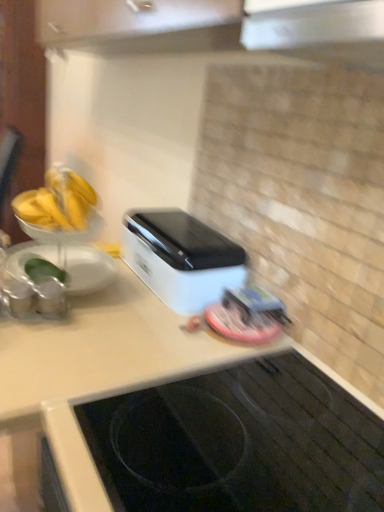
In order to face white glossy countertop at lower center, should I rotate leftwards or rightwards?

It's best to rotate right around 4.122 degrees.

The height and width of the screenshot is (512, 384). I want to click on white glossy countertop at lower center, so click(x=183, y=416).

This screenshot has height=512, width=384. What do you see at coordinates (183, 416) in the screenshot? I see `white glossy countertop at lower center` at bounding box center [183, 416].

In order to face white plastic toaster at center, should I rotate leftwards or rightwards?

Rotate your view left by about 1.999°.

Identify the location of white plastic toaster at center. The height and width of the screenshot is (512, 384). (181, 258).

The height and width of the screenshot is (512, 384). What do you see at coordinates (181, 258) in the screenshot?
I see `white plastic toaster at center` at bounding box center [181, 258].

This screenshot has height=512, width=384. I want to click on white glossy countertop at lower center, so click(183, 416).

Based on the photo, which object is positioned more to the right, white plastic toaster at center or white glossy countertop at lower center?

Positioned to the right is white glossy countertop at lower center.

In the scene shown: Which object is further away from the camera taking this photo, white plastic toaster at center or white glossy countertop at lower center?

white plastic toaster at center is further away from the camera.

Is point (221, 243) behind point (380, 505)?

That is True.

From the image's perspective, which one is positioned higher, white plastic toaster at center or white glossy countertop at lower center?

white plastic toaster at center appears higher in the image.

From a real-world perspective, which is physically below, white plastic toaster at center or white glossy countertop at lower center?

white glossy countertop at lower center, from a real-world perspective.

Does white plastic toaster at center have a lesser width compared to white glossy countertop at lower center?

Yes.

Considering the sizes of objects white plastic toaster at center and white glossy countertop at lower center in the image provided, who is taller, white plastic toaster at center or white glossy countertop at lower center?

white glossy countertop at lower center.

Is white plastic toaster at center smaller than white glossy countertop at lower center?

Indeed, white plastic toaster at center has a smaller size compared to white glossy countertop at lower center.

Is white plastic toaster at center not within white glossy countertop at lower center?

Yes.

Does white plastic toaster at center touch white glossy countertop at lower center?

No, white plastic toaster at center is not next to white glossy countertop at lower center.

Could you tell me if white plastic toaster at center is turned towards white glossy countertop at lower center?

No, white plastic toaster at center does not turn towards white glossy countertop at lower center.

How many degrees apart are the facing directions of white plastic toaster at center and white glossy countertop at lower center?

0.608 degrees separate the facing orientations of white plastic toaster at center and white glossy countertop at lower center.

Where is `countertop below the white plastic toaster at center (from the image's perspective)`? countertop below the white plastic toaster at center (from the image's perspective) is located at coordinates (183, 416).

Considering the relative positions of white glossy countertop at lower center and white plastic toaster at center in the image provided, is white glossy countertop at lower center to the left or to the right of white plastic toaster at center?

From the image, it's evident that white glossy countertop at lower center is to the right of white plastic toaster at center.

Is the position of white glossy countertop at lower center more distant than that of white plastic toaster at center?

No, the depth of white glossy countertop at lower center is less than that of white plastic toaster at center.

Which point is more forward, (261, 434) or (133, 243)?

The point (261, 434) is closer to the camera.

From the image's perspective, is white glossy countertop at lower center beneath white plastic toaster at center?

Yes, from the image's perspective, white glossy countertop at lower center is below white plastic toaster at center.

From a real-world perspective, does white glossy countertop at lower center stand above white plastic toaster at center?

No, from a real-world perspective, white glossy countertop at lower center is not over white plastic toaster at center

Does white glossy countertop at lower center have a greater width compared to white plastic toaster at center?

Yes.

Who is taller, white glossy countertop at lower center or white plastic toaster at center?

white glossy countertop at lower center is taller.

Considering the sizes of objects white glossy countertop at lower center and white plastic toaster at center in the image provided, who is smaller, white glossy countertop at lower center or white plastic toaster at center?

Smaller between the two is white plastic toaster at center.

Is white glossy countertop at lower center not inside white plastic toaster at center?

Yes.

Are white glossy countertop at lower center and white plastic toaster at center beside each other?

white glossy countertop at lower center and white plastic toaster at center are clearly separated.

Is white glossy countertop at lower center oriented away from white plastic toaster at center?

No.

What's the angular difference between white glossy countertop at lower center and white plastic toaster at center's facing directions?

The facing directions of white glossy countertop at lower center and white plastic toaster at center are 0.608 degrees apart.

How much distance is there between white glossy countertop at lower center and white plastic toaster at center?

white glossy countertop at lower center and white plastic toaster at center are 28.57 centimeters apart.

Locate an element on the screen. Image resolution: width=384 pixels, height=512 pixels. home appliance above the white glossy countertop at lower center (from the image's perspective) is located at coordinates (181, 258).

Identify the location of countertop that is under the white plastic toaster at center (from a real-world perspective). Image resolution: width=384 pixels, height=512 pixels. (183, 416).

Identify the location of home appliance lying above the white glossy countertop at lower center (from the image's perspective). (181, 258).